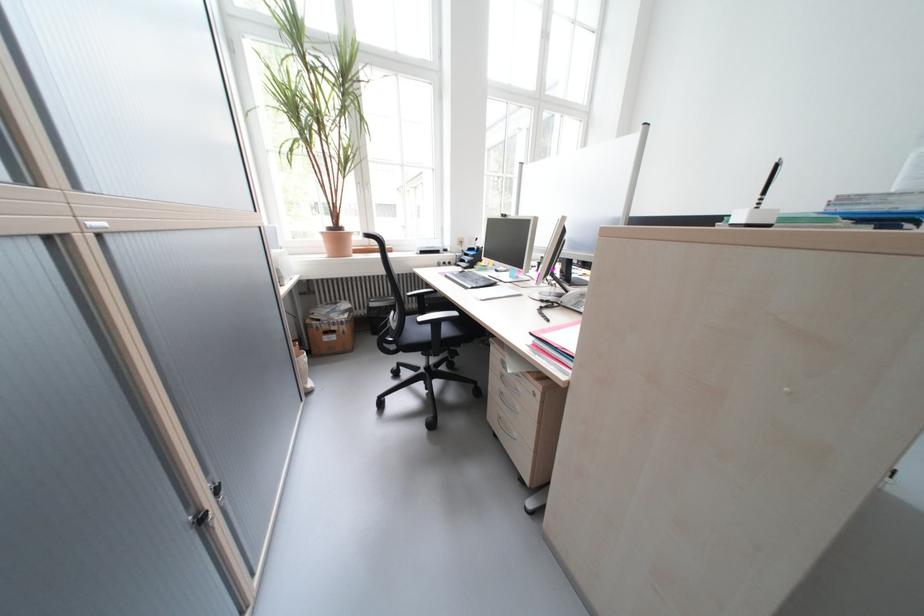
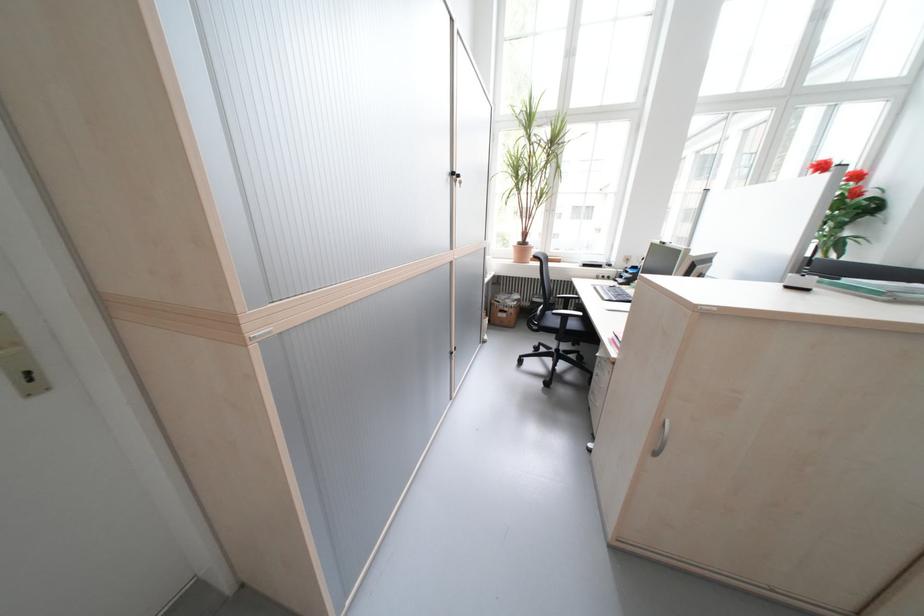
In the second image, find the point that corresponds to the point at 456,331 in the first image.

(582, 326)